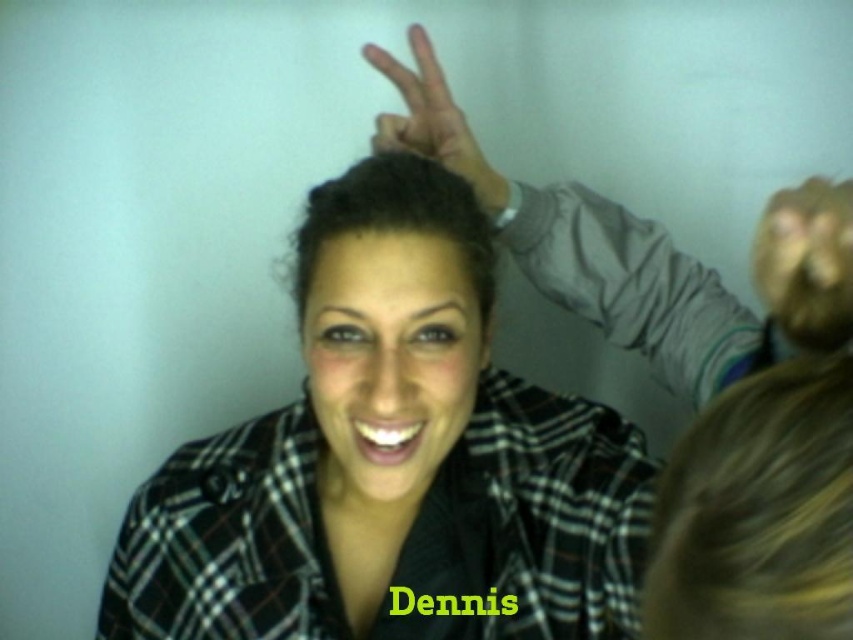
Does matte gray hand at upper center have a greater height compared to dark brown shiny hair at center?

Correct, matte gray hand at upper center is much taller as dark brown shiny hair at center.

Is matte gray hand at upper center shorter than dark brown shiny hair at center?

No, matte gray hand at upper center is not shorter than dark brown shiny hair at center.

Where is `matte gray hand at upper center`? matte gray hand at upper center is located at coordinates (585, 246).

Locate an element on the screen. This screenshot has width=853, height=640. matte gray hand at upper center is located at coordinates (585, 246).

Can you confirm if matte black face at center is positioned to the right of matte gray hand at upper center?

Incorrect, matte black face at center is not on the right side of matte gray hand at upper center.

Does matte black face at center appear over matte gray hand at upper center?

No, matte black face at center is not above matte gray hand at upper center.

In order to click on matte black face at center in this screenshot , I will do `click(389, 362)`.

Which is behind, point (834, 564) or point (306, 285)?

The point (306, 285) is more distant.

The image size is (853, 640). Describe the element at coordinates (758, 512) in the screenshot. I see `blonde hair at lower right` at that location.

Find the location of a particular element. The image size is (853, 640). blonde hair at lower right is located at coordinates (758, 512).